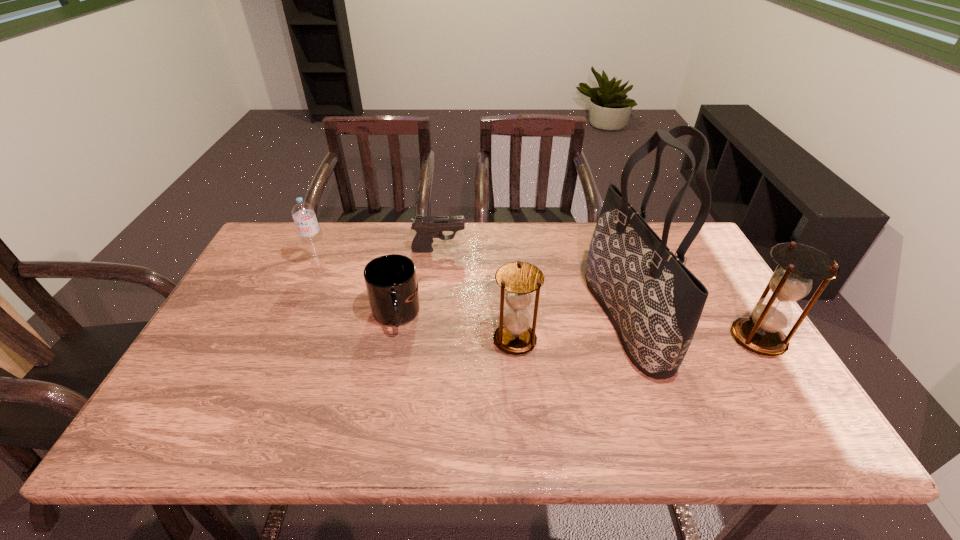
Where is `vacant position in the image that satisfies the following two spatial constraints: 1. at the barrel of the farthest object; 2. on the back side of the right hourglass`? vacant position in the image that satisfies the following two spatial constraints: 1. at the barrel of the farthest object; 2. on the back side of the right hourglass is located at coordinates (428, 339).